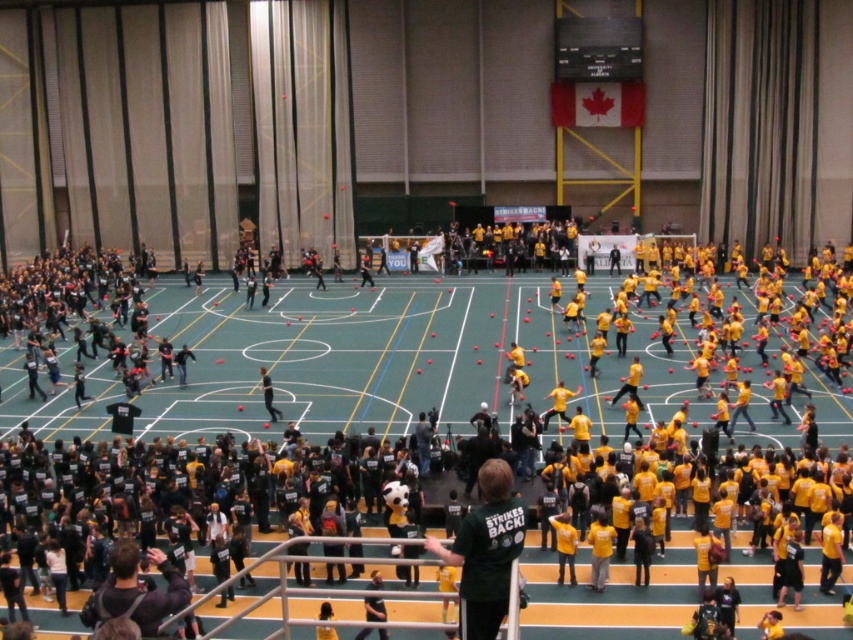
Question: Is green jersey at center wider than yellow matte shirt at center?

Choices:
 (A) yes
 (B) no

Answer: (A)

Question: Which point is closer to the camera taking this photo?

Choices:
 (A) (260, 372)
 (B) (457, 550)
 (C) (558, 404)

Answer: (B)

Question: Which object is closer to the camera taking this photo?

Choices:
 (A) yellow matte shirt at center
 (B) green jersey at center

Answer: (B)

Question: Considering the real-world distances, which object is closest to the green jersey at center?

Choices:
 (A) yellow matte shirt at center
 (B) yellow jersey at center

Answer: (A)

Question: Can you confirm if green jersey at center is positioned to the right of yellow jersey at center?

Choices:
 (A) no
 (B) yes

Answer: (B)

Question: Is green jersey at center thinner than yellow matte shirt at center?

Choices:
 (A) no
 (B) yes

Answer: (A)